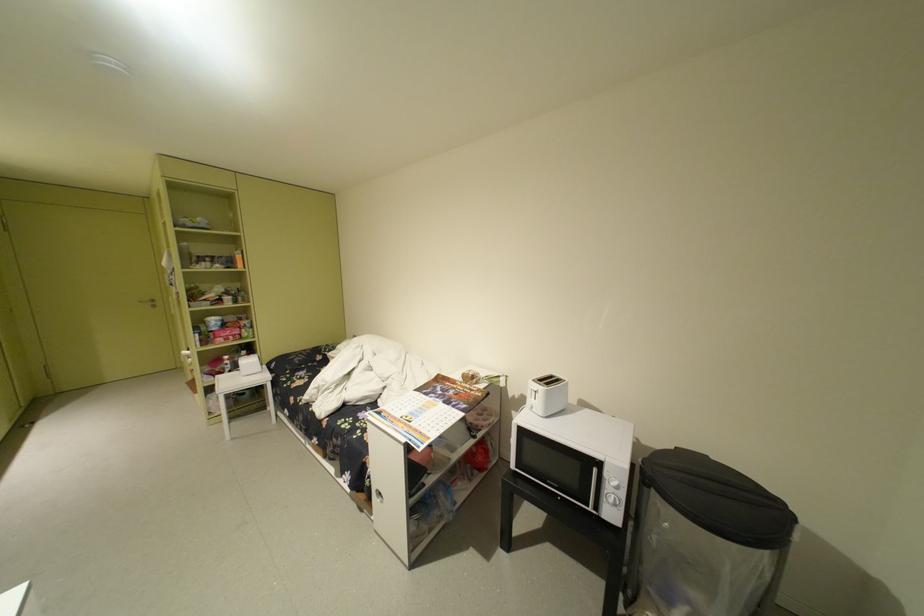
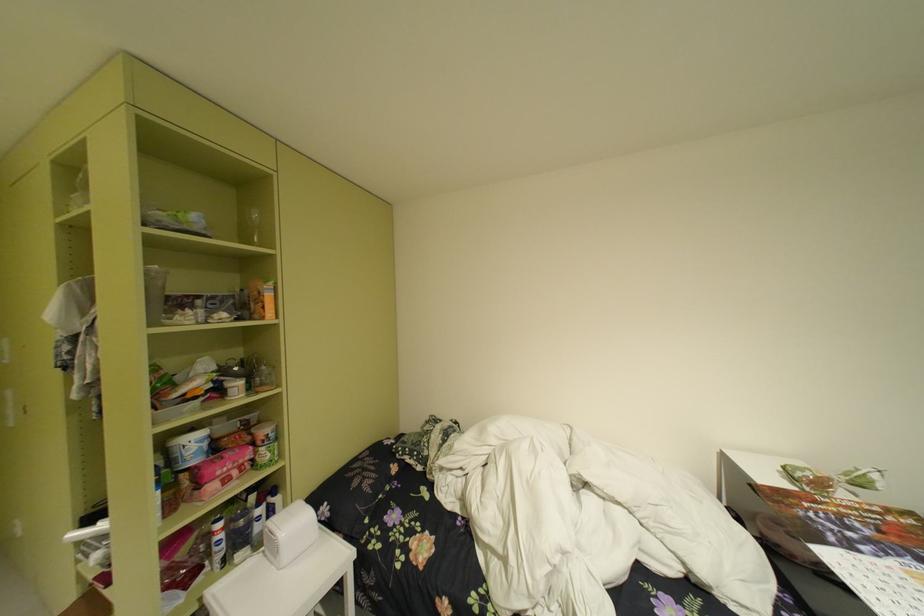
Find the pixel in the second image that matches (x=237, y=330) in the first image.

(238, 455)